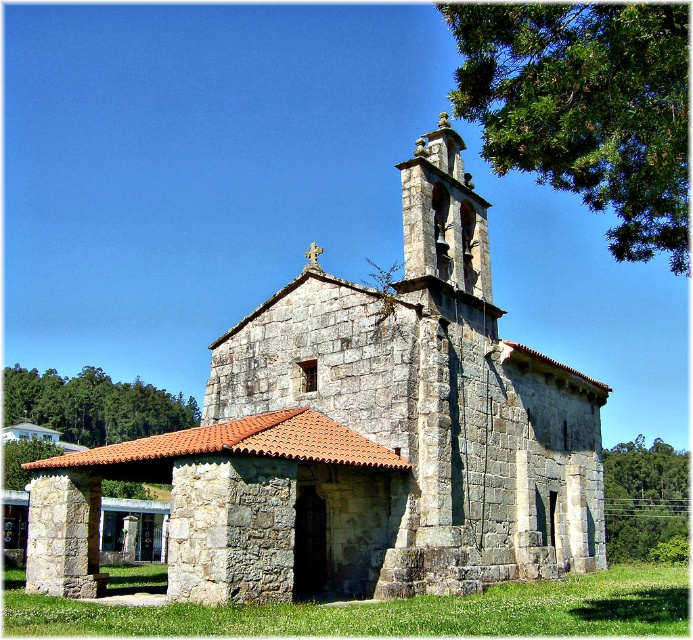
You are standing in front of the church and notice two points marked on the ground. The first point is at coordinate point [536,170] and the second is at point [46,372]. If you want to walk from the first point to the second point, which direction should you move relative to the church?

To move from point [536,170] to point [46,372], you should walk towards the lower right direction relative to the church since point [536,170] is in front of point [46,372].

Looking at this image, you are standing at the entrance of the gray stone church at center. Looking at the point marked at coordinates (x=359, y=436), which is part of the church structure, can you determine its location relative to the entrance?

The point marked at coordinates (x=359, y=436) is part of the gray stone church at center, so it is located at the center of the church structure relative to the entrance.